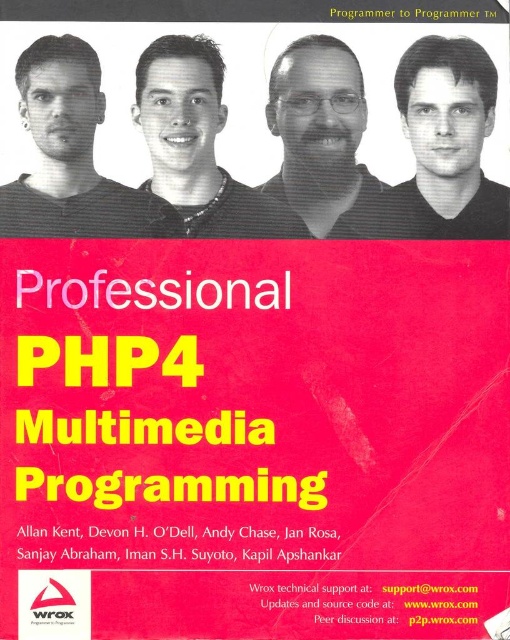
Question: Which of the following is the farthest from the observer?

Choices:
 (A) (344, 102)
 (B) (160, 61)

Answer: (A)

Question: Does matte black face at upper left lie in front of matte black face at center?

Choices:
 (A) yes
 (B) no

Answer: (A)

Question: Which point appears farthest from the camera in this image?

Choices:
 (A) [x=242, y=230]
 (B) [x=119, y=218]
 (C) [x=355, y=196]

Answer: (A)

Question: Considering the relative positions of matte black face at upper left and matte black shirt at center in the image provided, where is matte black face at upper left located with respect to matte black shirt at center?

Choices:
 (A) right
 (B) left

Answer: (B)

Question: Considering the real-world distances, which object is closest to the matte black face at center?

Choices:
 (A) matte black shirt at center
 (B) matte black face at upper left

Answer: (B)

Question: Does matte black face at upper left appear on the right side of matte black face at center?

Choices:
 (A) yes
 (B) no

Answer: (B)